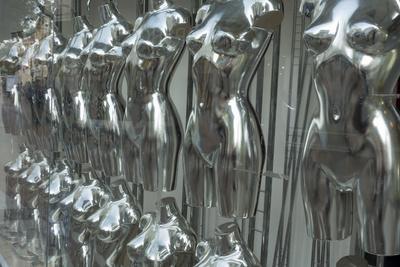
Locate an element on the screen. The height and width of the screenshot is (267, 400). ladder is located at coordinates (262, 211).